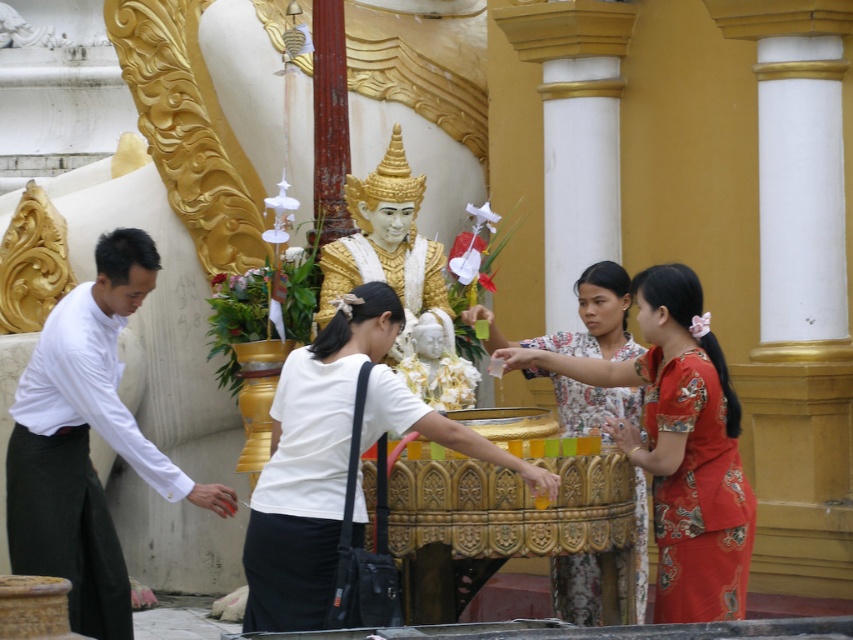
Question: Which of the following is the farthest from the observer?

Choices:
 (A) printed cotton blouse at center
 (B) gold plated statue at center
 (C) white matte shirt at left

Answer: (B)

Question: Which object is farther from the camera taking this photo?

Choices:
 (A) white matte shirt at center
 (B) gold plated statue at center
 (C) white porcelain statue at center

Answer: (B)

Question: Is printed cotton blouse at center thinner than white porcelain statue at center?

Choices:
 (A) no
 (B) yes

Answer: (A)

Question: Does silk floral dress at right have a greater width compared to printed cotton blouse at center?

Choices:
 (A) yes
 (B) no

Answer: (B)

Question: Is white matte shirt at left bigger than white matte shirt at center?

Choices:
 (A) yes
 (B) no

Answer: (A)

Question: Which of the following is the farthest from the observer?

Choices:
 (A) (582, 426)
 (B) (315, 376)

Answer: (A)